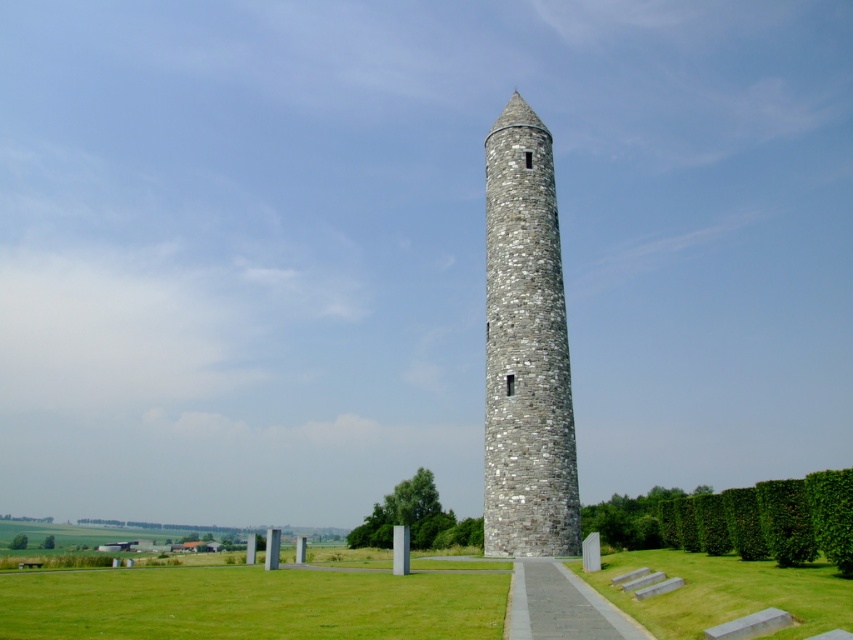
In the scene shown: You are standing at the edge of the open grassy field and want to walk directly to the base of the gray stone tower at center. There is a gray concrete path at center in your way. Which object will you encounter first as you walk towards the tower?

You will encounter the gray concrete path at center first because it is closer to you than the gray stone tower at center, which is further away.

You are standing at the camera position and want to reach the point marked at coordinates (181,620). The path you need to take is 25.99 meters long. If you walk at a speed of 1.5 meters per second, how many seconds will it take you to reach the point?

The point marked at coordinates (181,620) is 25.99 meters away from the camera. At a walking speed of 1.5 meters per second, it will take approximately 17.33 seconds to reach the point.